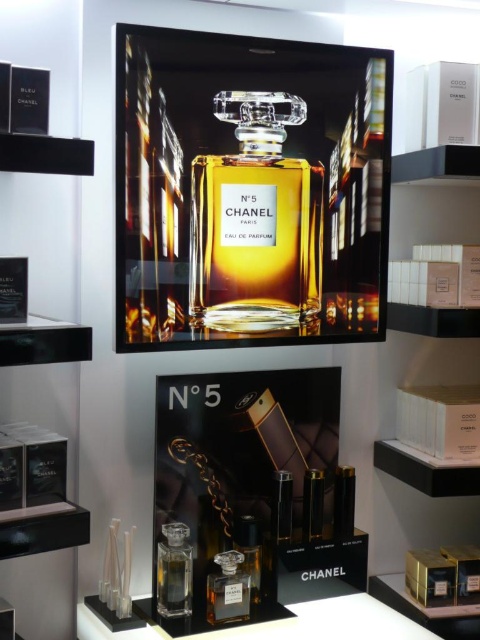
Based on the photo, does matte glass perfume bottle at center have a greater height compared to transparent glass perfume at lower center?

Indeed, matte glass perfume bottle at center has a greater height compared to transparent glass perfume at lower center.

Is point (305, 241) positioned in front of point (182, 536)?

No, it is not.

What do you see at coordinates (255, 221) in the screenshot? This screenshot has height=640, width=480. I see `matte glass perfume bottle at center` at bounding box center [255, 221].

This screenshot has width=480, height=640. I want to click on matte glass perfume bottle at center, so click(255, 221).

I want to click on matte glass perfume bottle at center, so click(x=255, y=221).

The image size is (480, 640). I want to click on matte glass perfume bottle at center, so click(x=255, y=221).

Who is taller, transparent glass perfume at lower center or matte glass perfume at center?

With more height is transparent glass perfume at lower center.

What do you see at coordinates (173, 572) in the screenshot? This screenshot has width=480, height=640. I see `transparent glass perfume at lower center` at bounding box center [173, 572].

Who is more distant from viewer, (167, 605) or (247, 592)?

Point (247, 592)

The height and width of the screenshot is (640, 480). What are the coordinates of `transparent glass perfume at lower center` in the screenshot? It's located at (173, 572).